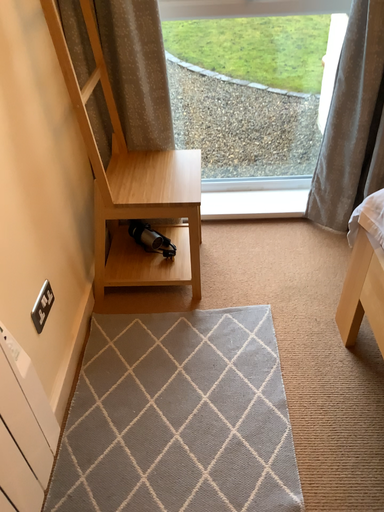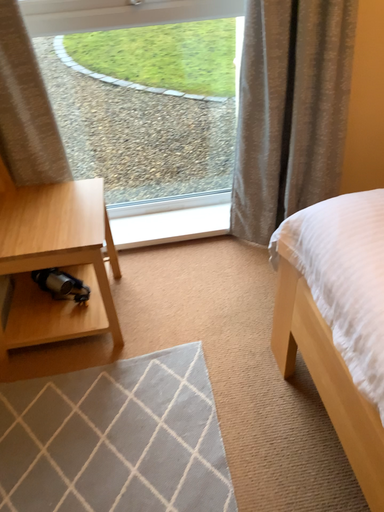
Question: How did the camera likely rotate when shooting the video?

Choices:
 (A) rotated left
 (B) rotated right

Answer: (B)